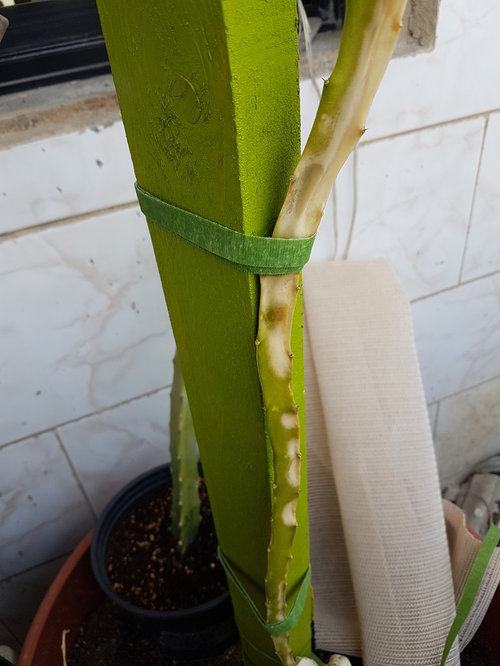
Where is `1 beige mat`? 1 beige mat is located at coordinates (398, 421).